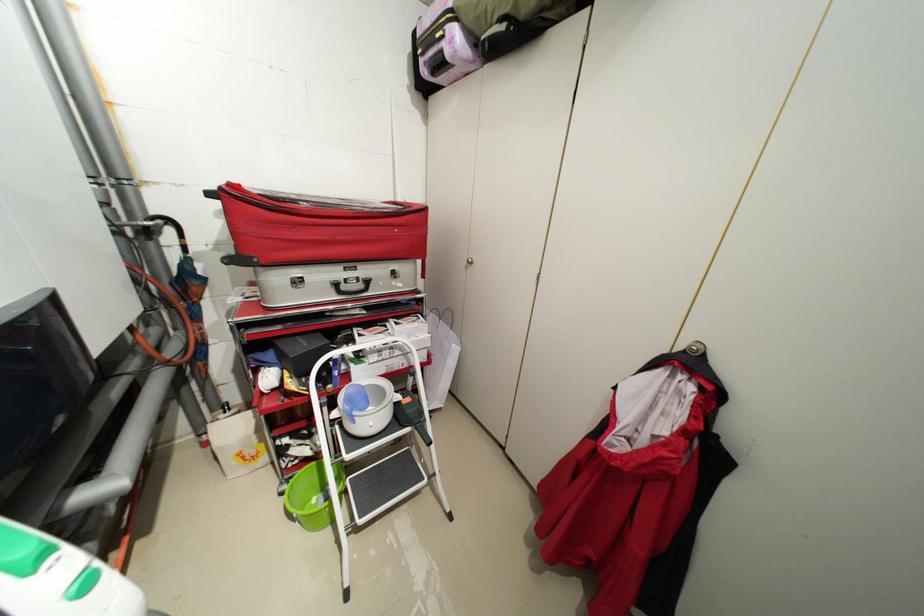
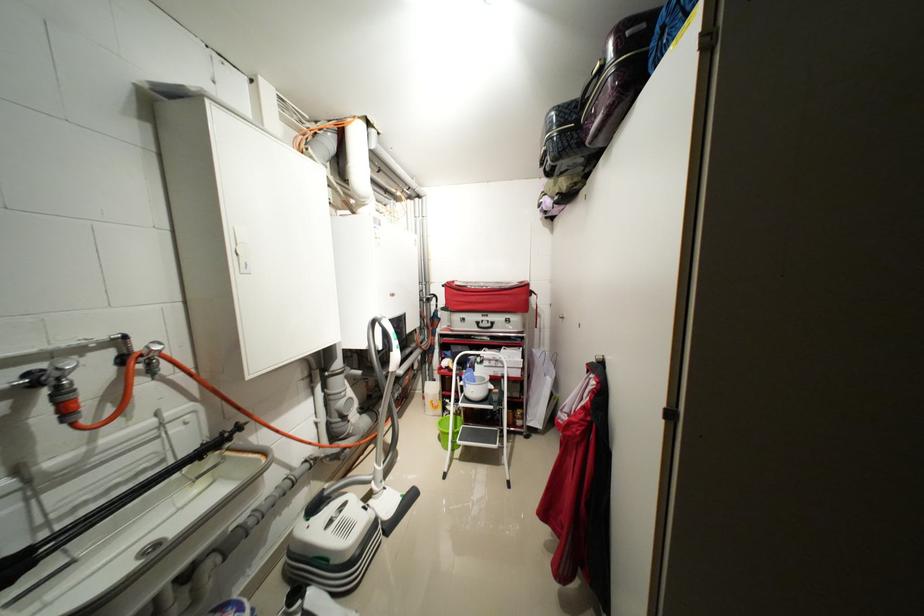
The point at the highlighted location is marked in the first image. Where is the corresponding point in the second image?

(455, 284)